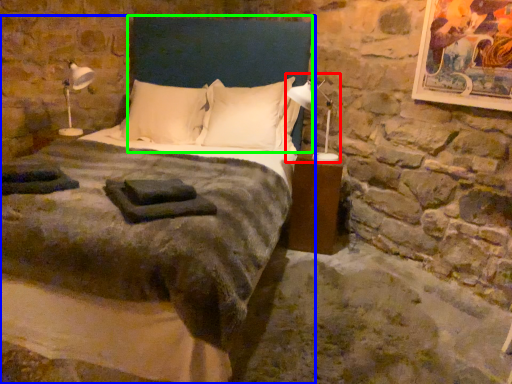
Question: Considering the real-world distances, which object is closest to bedside lamp (highlighted by a red box)? bed (highlighted by a blue box) or headboard (highlighted by a green box).

Choices:
 (A) bed
 (B) headboard

Answer: (B)